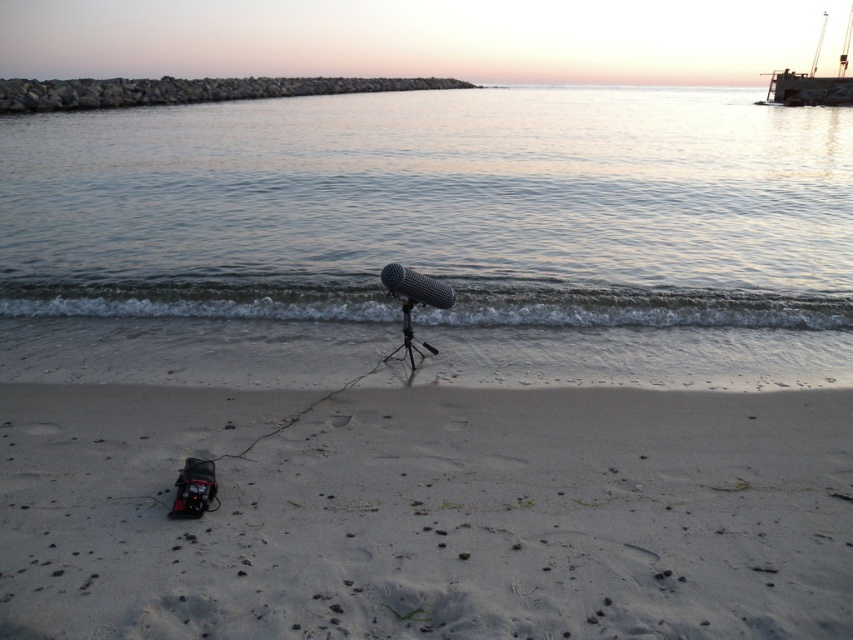
You are a photographer standing at the shoreline and want to take a photo of the metallic gray boat at upper right without the black matte tripod at center appearing in the frame. Is this possible based on their positions?

The metallic gray boat at upper right is further to the viewer than the black matte tripod at center, so the tripod is closer to you. To avoid the tripod in the frame, you can move closer to the boat or adjust your angle so the tripod is out of sight.

You are a sound engineer setting up equipment on the beach. You have a white sandy beach at lower center and a black matte tripod at center. Which object is closer to you as you face the scene?

The white sandy beach at lower center is closer to you because it is in front of the black matte tripod at center.

Based on the photo, you are a sound engineer setting up equipment on the beach. You have a white sandy beach at lower center and a black matte tripod at center. Which object takes up more space in the scene?

The white sandy beach at lower center takes up more space in the scene as it is bigger than the black matte tripod at center.